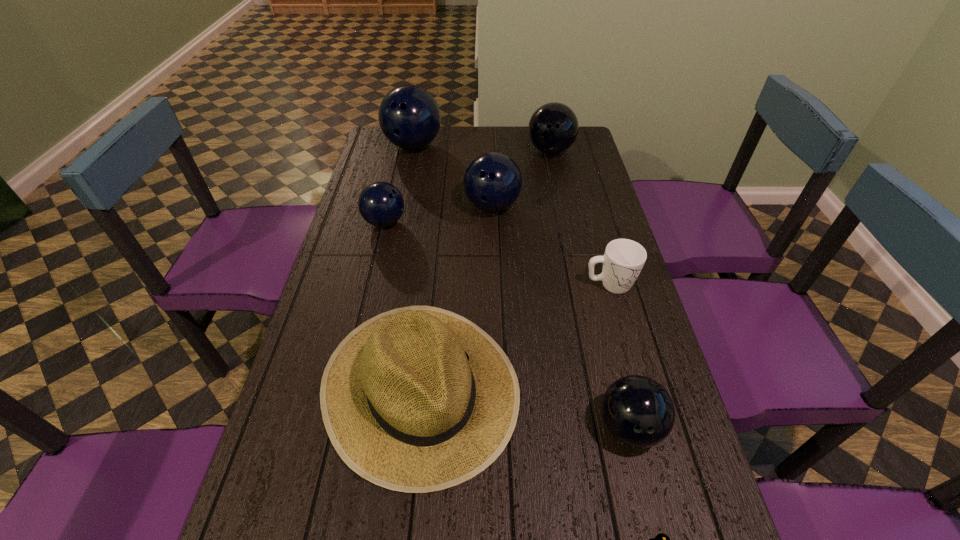
Find the location of a particular element. The height and width of the screenshot is (540, 960). the tallest object is located at coordinates (409, 117).

Locate an element on the screen. This screenshot has width=960, height=540. the tallest bowling ball is located at coordinates (409, 117).

The height and width of the screenshot is (540, 960). I want to click on the bigger black bowling ball, so click(553, 128).

Where is `the third bowling ball from right to left`? the third bowling ball from right to left is located at coordinates (492, 182).

At what (x,y) coordinates should I click in order to perform the action: click on the rightmost blue bowling ball. Please return your answer as a coordinate pair (x, y). Looking at the image, I should click on (492, 182).

Where is `sunhat`? sunhat is located at coordinates (417, 399).

Identify the location of the smallest blue bowling ball. This screenshot has width=960, height=540. coord(381,204).

Find the location of a particular element. the nearest bowling ball is located at coordinates (638, 411).

Locate an element on the screen. The width and height of the screenshot is (960, 540). the smaller black bowling ball is located at coordinates (638, 411).

The width and height of the screenshot is (960, 540). Find the location of `mug`. mug is located at coordinates (623, 260).